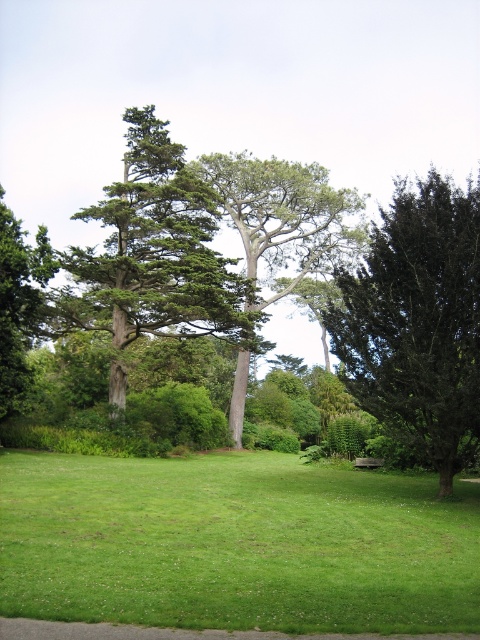
You are standing at the point with coordinates point (236,545). What is the color of the surface you are currently standing on?

The point (236,545) corresponds to green grass at center, so the surface is green.

You are standing in the park and want to take a photo of the green textured tree at center. If your camera has a screen that shows coordinates, where should you aim your camera to capture it?

You should aim your camera at the coordinates point (152, 257) to capture the green textured tree at center.

You are standing in the park and see the green textured tree at center and the green matte tree at left. Which tree is closer to your left side?

The green matte tree at left is closer to your left side because it is positioned to the left of the green textured tree at center.